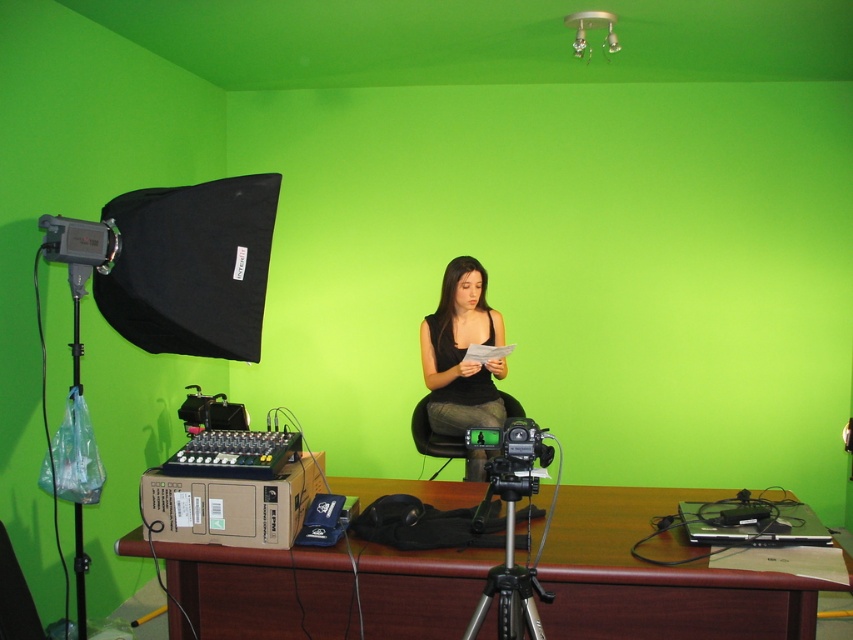
Question: Which of the following is the farthest from the observer?

Choices:
 (A) black matte dress at center
 (B) silver metallic tripod at center

Answer: (A)

Question: Which object is closer to the camera taking this photo?

Choices:
 (A) black matte dress at center
 (B) brown wooden table at center
 (C) silver metallic tripod at center

Answer: (C)

Question: From the image, what is the correct spatial relationship of black matte dress at center in relation to silver metallic tripod at center?

Choices:
 (A) left
 (B) right

Answer: (A)

Question: Is the position of black matte dress at center less distant than that of silver metallic tripod at center?

Choices:
 (A) yes
 (B) no

Answer: (B)

Question: Can you confirm if black matte dress at center is wider than silver metallic tripod at center?

Choices:
 (A) no
 (B) yes

Answer: (B)

Question: Among these objects, which one is farthest from the camera?

Choices:
 (A) black matte dress at center
 (B) brown wooden table at center

Answer: (A)